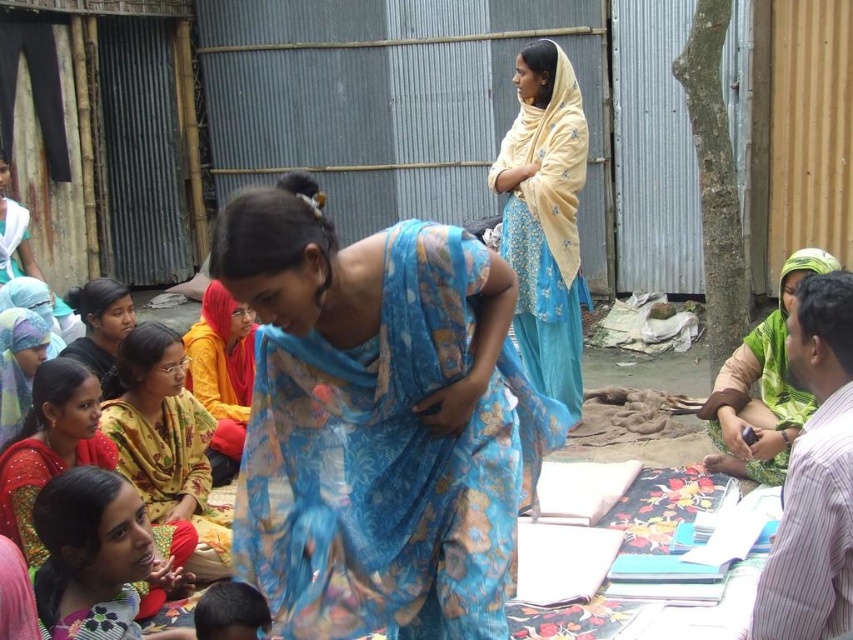
Is green textured saree at right above blue floral saree at center?

Actually, green textured saree at right is below blue floral saree at center.

What do you see at coordinates (762, 388) in the screenshot? The image size is (853, 640). I see `green textured saree at right` at bounding box center [762, 388].

Identify the location of green textured saree at right. This screenshot has height=640, width=853. (762, 388).

Does point (68, 422) lie in front of point (24, 211)?

Yes, point (68, 422) is in front of point (24, 211).

Does matte yellow saree at lower left appear under blue floral saree at center?

Yes, matte yellow saree at lower left is below blue floral saree at center.

Is point (94, 385) positioned after point (64, 312)?

That is False.

Locate an element on the screen. This screenshot has height=640, width=853. matte yellow saree at lower left is located at coordinates (50, 445).

The image size is (853, 640). I want to click on floral silk saree at center, so (378, 422).

Which is behind, point (397, 593) or point (80, 564)?

The point (80, 564) is behind.

Locate an element on the screen. Image resolution: width=853 pixels, height=640 pixels. floral silk saree at center is located at coordinates (378, 422).